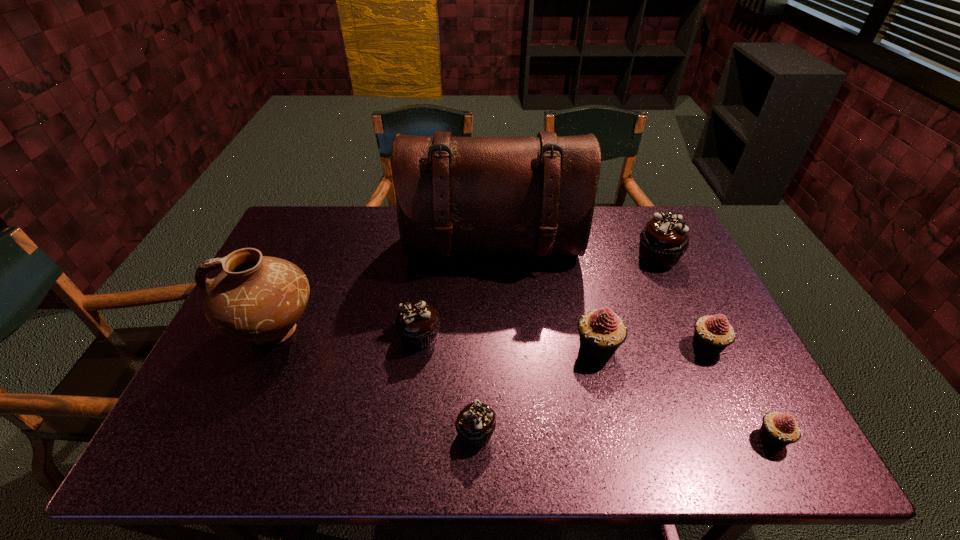
Where is `the second biggest pink cupcake`? This screenshot has width=960, height=540. the second biggest pink cupcake is located at coordinates (712, 334).

Where is `the nearest brown cupcake`? This screenshot has width=960, height=540. the nearest brown cupcake is located at coordinates (475, 424).

The width and height of the screenshot is (960, 540). I want to click on the second brown cupcake from right to left, so click(475, 424).

The width and height of the screenshot is (960, 540). I want to click on the smallest pink cupcake, so click(x=778, y=430).

Identify the location of blank space located 0.140m on the front-facing side of the satchel. (495, 314).

Where is `vacant space located 0.070m on the back of the biggest pink cupcake`? The image size is (960, 540). vacant space located 0.070m on the back of the biggest pink cupcake is located at coordinates (588, 311).

Image resolution: width=960 pixels, height=540 pixels. I want to click on vacant space located 0.090m on the back of the farthest cupcake, so click(644, 226).

You are a GUI agent. You are given a task and a screenshot of the screen. Output one action in this format:
    pyautogui.click(x=<x>, y=<y>)
    Task: Click on the free space located 0.210m on the back of the second nearest brown cupcake
    This screenshot has width=960, height=540.
    Given the screenshot: What is the action you would take?
    pyautogui.click(x=428, y=268)

At what (x,y) coordinates should I click in order to perform the action: click on vacant position located on the left of the second smallest pink cupcake. Please return your answer as a coordinate pair (x, y). The width and height of the screenshot is (960, 540). Looking at the image, I should click on (649, 347).

Where is `vacant region located on the left of the fifth cupcake from right to left`? vacant region located on the left of the fifth cupcake from right to left is located at coordinates (420, 434).